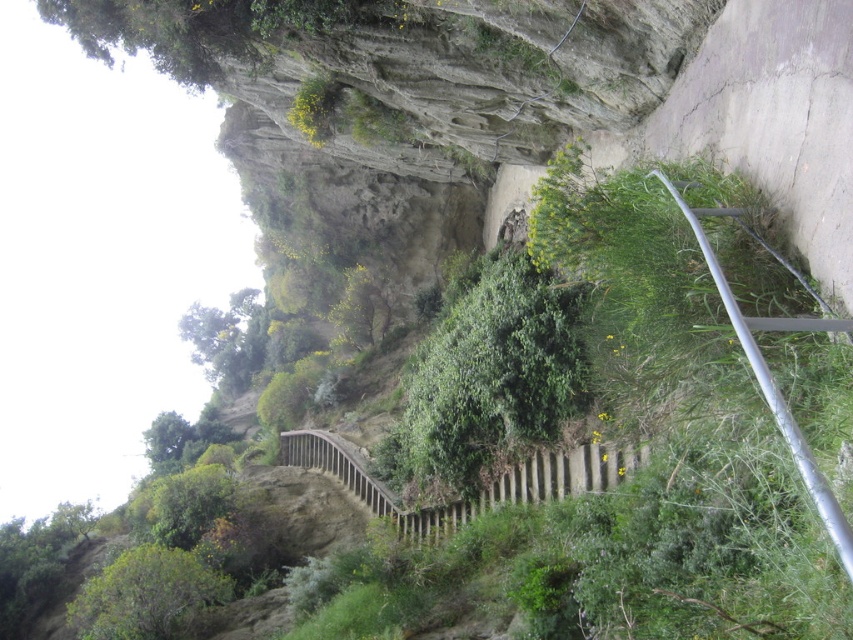
Looking at this image, who is higher up, green leafy bush at center or silver metallic rail at right?

Positioned higher is silver metallic rail at right.

Between point (415, 477) and point (851, 563), which one is positioned behind?

The point (415, 477) is behind.

The width and height of the screenshot is (853, 640). In order to click on green leafy bush at center in this screenshot , I will do `click(486, 380)`.

Does green leafy bush at center have a greater width compared to brown wooden rail at center?

No.

Is green leafy bush at center to the right of brown wooden rail at center from the viewer's perspective?

Yes, green leafy bush at center is to the right of brown wooden rail at center.

Is point (421, 384) behind point (608, 468)?

Yes, point (421, 384) is behind point (608, 468).

Image resolution: width=853 pixels, height=640 pixels. Find the location of `green leafy bush at center`. green leafy bush at center is located at coordinates (486, 380).

Is brown wooden rail at center positioned in front of silver metallic rail at right?

That is False.

Between point (401, 532) and point (782, 324), which one is positioned behind?

The point (401, 532) is more distant.

Does point (364, 488) lie in front of point (828, 536)?

No, it is behind (828, 536).

The height and width of the screenshot is (640, 853). Find the location of `brown wooden rail at center`. brown wooden rail at center is located at coordinates (479, 492).